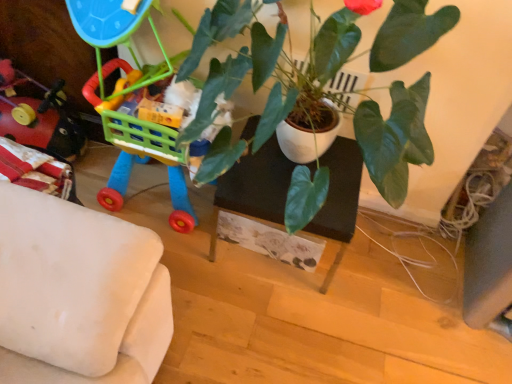
Question: Would you say rubberized plastic toy at left, the second toy viewed from the right, is inside or outside black matte table at center?

Choices:
 (A) inside
 (B) outside

Answer: (B)

Question: Considering the relative positions of rubberized plastic toy at left, the second toy viewed from the right, and black matte table at center in the image provided, is rubberized plastic toy at left, the second toy viewed from the right, to the left or to the right of black matte table at center?

Choices:
 (A) left
 (B) right

Answer: (A)

Question: Which of these objects is positioned closest to the rubberized plastic toy at left, which appears as the first toy when viewed from the left?

Choices:
 (A) plastic toy cart at left, which is the second toy in left-to-right order
 (B) green glossy plant at center
 (C) black matte table at center

Answer: (A)

Question: Which is farther from the black matte table at center?

Choices:
 (A) rubberized plastic toy at left, which appears as the first toy when viewed from the left
 (B) plastic toy cart at left, the 1th toy from the right
 (C) green glossy plant at center

Answer: (A)